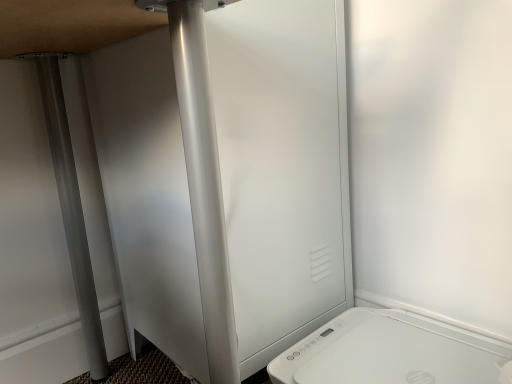
Question: Considering the relative sizes of satin silver screen door at center and white plastic toaster at lower right in the image provided, is satin silver screen door at center taller than white plastic toaster at lower right?

Choices:
 (A) no
 (B) yes

Answer: (B)

Question: Considering the relative positions of satin silver screen door at center and white plastic toaster at lower right in the image provided, is satin silver screen door at center to the right of white plastic toaster at lower right from the viewer's perspective?

Choices:
 (A) no
 (B) yes

Answer: (A)

Question: Considering the relative sizes of satin silver screen door at center and white plastic toaster at lower right in the image provided, is satin silver screen door at center thinner than white plastic toaster at lower right?

Choices:
 (A) no
 (B) yes

Answer: (A)

Question: Is satin silver screen door at center oriented away from white plastic toaster at lower right?

Choices:
 (A) yes
 (B) no

Answer: (B)

Question: Is white plastic toaster at lower right inside satin silver screen door at center?

Choices:
 (A) yes
 (B) no

Answer: (B)

Question: Is satin silver screen door at center beside white plastic toaster at lower right?

Choices:
 (A) no
 (B) yes

Answer: (A)

Question: Can you confirm if white plastic toaster at lower right is bigger than satin silver screen door at center?

Choices:
 (A) yes
 (B) no

Answer: (B)

Question: Does white plastic toaster at lower right turn towards satin silver screen door at center?

Choices:
 (A) no
 (B) yes

Answer: (A)

Question: Considering the relative sizes of white plastic toaster at lower right and satin silver screen door at center in the image provided, is white plastic toaster at lower right shorter than satin silver screen door at center?

Choices:
 (A) yes
 (B) no

Answer: (A)

Question: Is white plastic toaster at lower right turned away from satin silver screen door at center?

Choices:
 (A) yes
 (B) no

Answer: (B)

Question: From the image's perspective, is white plastic toaster at lower right located beneath satin silver screen door at center?

Choices:
 (A) no
 (B) yes

Answer: (B)

Question: Is white plastic toaster at lower right positioned before satin silver screen door at center?

Choices:
 (A) yes
 (B) no

Answer: (A)

Question: Is point (282, 294) positioned closer to the camera than point (444, 367)?

Choices:
 (A) closer
 (B) farther

Answer: (B)